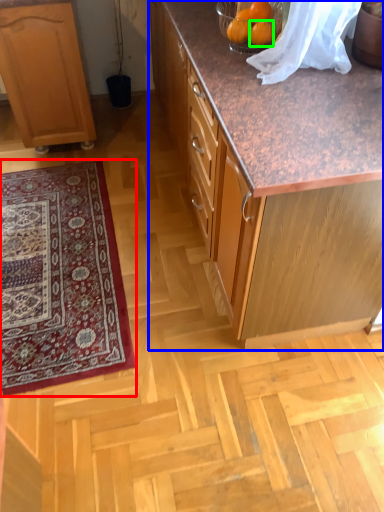
Question: Which object is positioned farthest from mat (highlighted by a red box)? Select from cabinetry (highlighted by a blue box) and orange (highlighted by a green box).

Choices:
 (A) cabinetry
 (B) orange

Answer: (B)